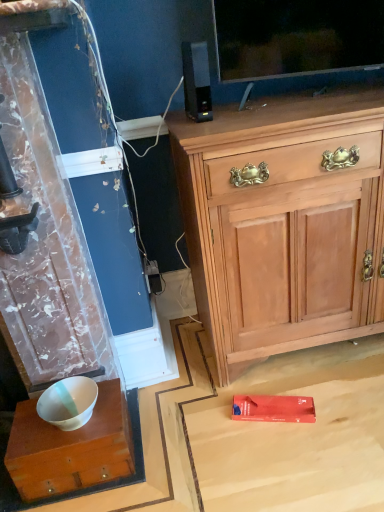
Question: From a real-world perspective, is light wood cabinet at upper right over white glossy wood desk at lower left?

Choices:
 (A) no
 (B) yes

Answer: (B)

Question: From the image's perspective, does light wood cabinet at upper right appear higher than white glossy wood desk at lower left?

Choices:
 (A) no
 (B) yes

Answer: (B)

Question: Is light wood cabinet at upper right far away from white glossy wood desk at lower left?

Choices:
 (A) yes
 (B) no

Answer: (B)

Question: Considering the relative positions of light wood cabinet at upper right and white glossy wood desk at lower left in the image provided, is light wood cabinet at upper right behind white glossy wood desk at lower left?

Choices:
 (A) no
 (B) yes

Answer: (A)

Question: Does light wood cabinet at upper right have a lesser height compared to white glossy wood desk at lower left?

Choices:
 (A) no
 (B) yes

Answer: (A)

Question: Is white glossy wood desk at lower left in front of or behind light wood cabinet at upper right in the image?

Choices:
 (A) behind
 (B) front

Answer: (A)

Question: In terms of width, does white glossy wood desk at lower left look wider or thinner when compared to light wood cabinet at upper right?

Choices:
 (A) wide
 (B) thin

Answer: (B)

Question: Based on their positions, is white glossy wood desk at lower left located to the left or right of light wood cabinet at upper right?

Choices:
 (A) left
 (B) right

Answer: (A)

Question: Is white glossy wood desk at lower left bigger or smaller than light wood cabinet at upper right?

Choices:
 (A) small
 (B) big

Answer: (A)

Question: From the image's perspective, is black plastic speaker at upper center located above or below white glossy wood desk at lower left?

Choices:
 (A) below
 (B) above

Answer: (B)

Question: In terms of size, does black plastic speaker at upper center appear bigger or smaller than white glossy wood desk at lower left?

Choices:
 (A) big
 (B) small

Answer: (B)

Question: From a real-world perspective, relative to white glossy wood desk at lower left, is black plastic speaker at upper center vertically above or below?

Choices:
 (A) below
 (B) above

Answer: (B)

Question: Choose the correct answer: Is black plastic speaker at upper center inside white glossy wood desk at lower left or outside it?

Choices:
 (A) inside
 (B) outside

Answer: (B)

Question: Considering the positions of point (72, 452) and point (198, 90), is point (72, 452) closer or farther from the camera than point (198, 90)?

Choices:
 (A) closer
 (B) farther

Answer: (A)

Question: From a real-world perspective, relative to black plastic speaker at upper center, is white glossy wood desk at lower left vertically above or below?

Choices:
 (A) above
 (B) below

Answer: (B)